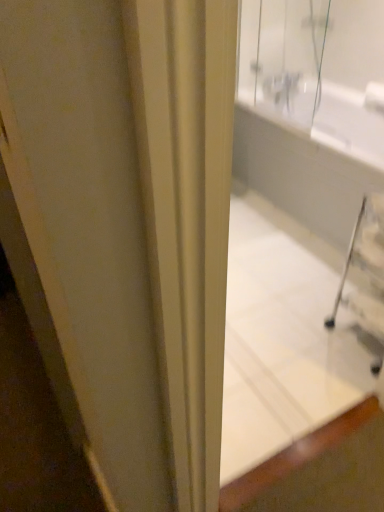
Question: From the image's perspective, is white glossy bathtub at center above or below white glossy bathtub at upper right?

Choices:
 (A) below
 (B) above

Answer: (A)

Question: In the image, is white glossy bathtub at center on the left side or the right side of white glossy bathtub at upper right?

Choices:
 (A) right
 (B) left

Answer: (B)

Question: From a real-world perspective, relative to white glossy bathtub at upper right, is white glossy bathtub at center vertically above or below?

Choices:
 (A) above
 (B) below

Answer: (A)

Question: Is point (251, 155) closer or farther from the camera than point (284, 2)?

Choices:
 (A) farther
 (B) closer

Answer: (A)

Question: Looking at their shapes, would you say white glossy bathtub at upper right is wider or thinner than white glossy bathtub at center?

Choices:
 (A) wide
 (B) thin

Answer: (A)

Question: Considering the positions of white glossy bathtub at upper right and white glossy bathtub at center in the image, is white glossy bathtub at upper right bigger or smaller than white glossy bathtub at center?

Choices:
 (A) small
 (B) big

Answer: (B)

Question: Is white glossy bathtub at upper right to the left or to the right of white glossy bathtub at center in the image?

Choices:
 (A) right
 (B) left

Answer: (A)